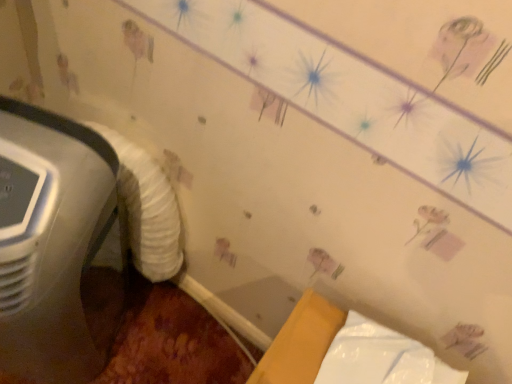
Question: Considering the relative sizes of white plastic air conditioner at left and white glossy wrapping paper at lower right in the image provided, is white plastic air conditioner at left taller than white glossy wrapping paper at lower right?

Choices:
 (A) yes
 (B) no

Answer: (A)

Question: Is white plastic air conditioner at left not near white glossy wrapping paper at lower right?

Choices:
 (A) yes
 (B) no

Answer: (B)

Question: Is white plastic air conditioner at left not within white glossy wrapping paper at lower right?

Choices:
 (A) yes
 (B) no

Answer: (A)

Question: Is white plastic air conditioner at left bigger than white glossy wrapping paper at lower right?

Choices:
 (A) no
 (B) yes

Answer: (B)

Question: Is white plastic air conditioner at left turned away from white glossy wrapping paper at lower right?

Choices:
 (A) no
 (B) yes

Answer: (A)

Question: Considering the positions of white glossy wrapping paper at lower right and white fluffy sheet at left in the image, is white glossy wrapping paper at lower right wider or thinner than white fluffy sheet at left?

Choices:
 (A) thin
 (B) wide

Answer: (B)

Question: Is point (337, 354) positioned closer to the camera than point (128, 195)?

Choices:
 (A) farther
 (B) closer

Answer: (B)

Question: From the image's perspective, is white glossy wrapping paper at lower right located above or below white fluffy sheet at left?

Choices:
 (A) below
 (B) above

Answer: (A)

Question: Would you say white glossy wrapping paper at lower right is inside or outside white fluffy sheet at left?

Choices:
 (A) inside
 (B) outside

Answer: (B)

Question: Considering the positions of white plastic air conditioner at left and white glossy wrapping paper at lower right in the image, is white plastic air conditioner at left wider or thinner than white glossy wrapping paper at lower right?

Choices:
 (A) wide
 (B) thin

Answer: (A)

Question: From the image's perspective, relative to white glossy wrapping paper at lower right, is white plastic air conditioner at left above or below?

Choices:
 (A) above
 (B) below

Answer: (A)

Question: Based on their sizes in the image, would you say white plastic air conditioner at left is bigger or smaller than white glossy wrapping paper at lower right?

Choices:
 (A) big
 (B) small

Answer: (A)

Question: Choose the correct answer: Is white plastic air conditioner at left inside white glossy wrapping paper at lower right or outside it?

Choices:
 (A) outside
 (B) inside

Answer: (A)

Question: Is white plastic air conditioner at left in front of or behind white fluffy sheet at left in the image?

Choices:
 (A) behind
 (B) front

Answer: (B)

Question: Based on their positions, is white plastic air conditioner at left located to the left or right of white fluffy sheet at left?

Choices:
 (A) left
 (B) right

Answer: (A)